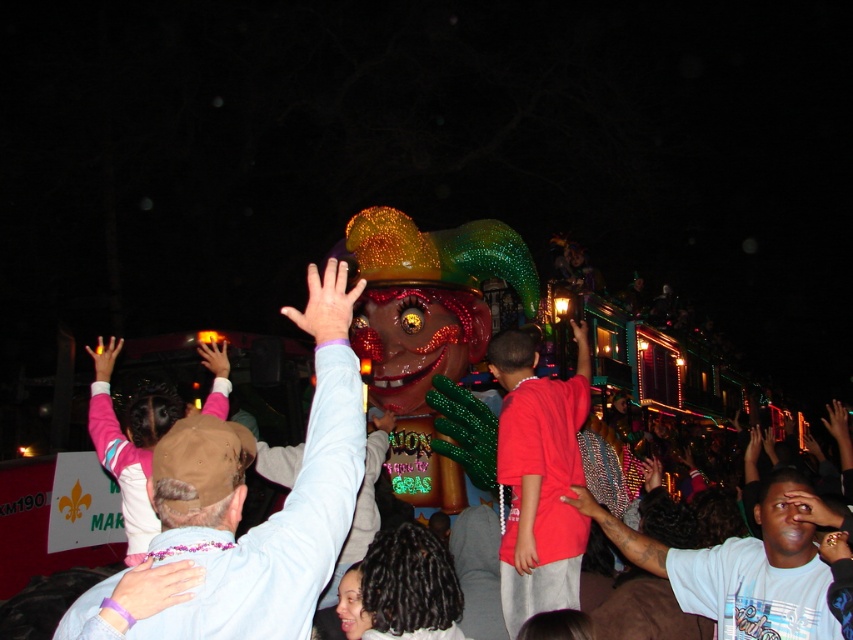
Question: Does light blue cotton shirt at upper center have a lesser width compared to pink fleece jacket at upper left?

Choices:
 (A) no
 (B) yes

Answer: (A)

Question: Among these objects, which one is farthest from the camera?

Choices:
 (A) red matte shirt at center
 (B) white t-shirt at center
 (C) light blue cotton shirt at upper center

Answer: (A)

Question: Does red matte shirt at center come in front of white t-shirt at center?

Choices:
 (A) no
 (B) yes

Answer: (A)

Question: Which object is positioned farthest from the red matte shirt at center?

Choices:
 (A) light blue cotton shirt at upper center
 (B) white t-shirt at center

Answer: (A)

Question: In this image, where is white t-shirt at center located relative to pink fleece jacket at upper left?

Choices:
 (A) above
 (B) below

Answer: (B)

Question: Among these points, which one is farthest from the camera?

Choices:
 (A) click(x=637, y=563)
 (B) click(x=103, y=352)

Answer: (B)